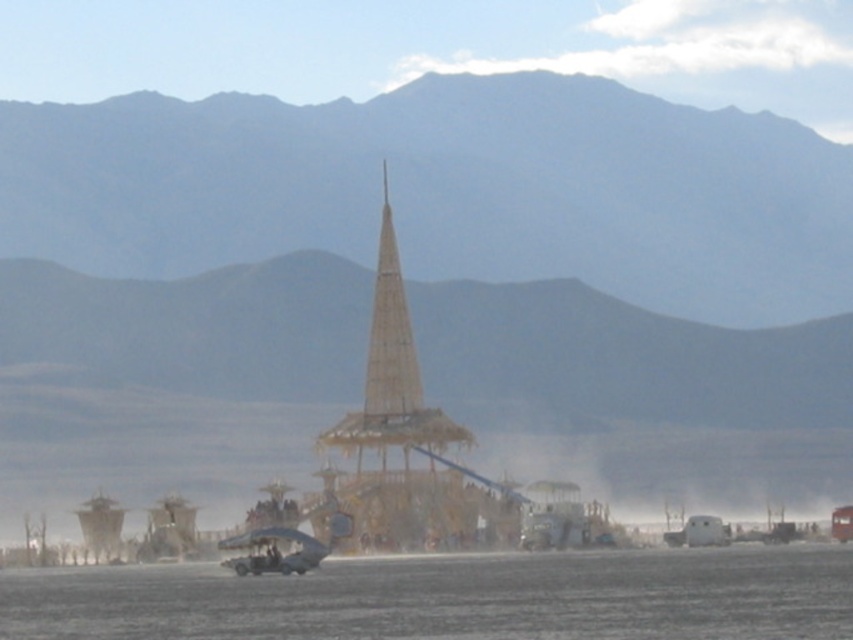
Which is below, desert sand mountain at center or clear ice at lower center?

clear ice at lower center is lower down.

The height and width of the screenshot is (640, 853). What are the coordinates of `desert sand mountain at center` in the screenshot? It's located at (447, 189).

This screenshot has width=853, height=640. Identify the location of desert sand mountain at center. (447, 189).

Does wooden tower at center have a smaller size compared to metallic silver fighter jet at center?

Incorrect, wooden tower at center is not smaller in size than metallic silver fighter jet at center.

Looking at this image, who is taller, wooden tower at center or metallic silver fighter jet at center?

Standing taller between the two is wooden tower at center.

Is point (367, 429) positioned in front of point (347, 515)?

Yes, it is in front of point (347, 515).

Image resolution: width=853 pixels, height=640 pixels. What are the coordinates of `wooden tower at center` in the screenshot? It's located at (397, 428).

Does desert sand mountain at center have a greater height compared to wooden tower at center?

No, desert sand mountain at center is not taller than wooden tower at center.

Can you confirm if desert sand mountain at center is positioned to the left of wooden tower at center?

Incorrect, desert sand mountain at center is not on the left side of wooden tower at center.

Who is more distant from viewer, (845, 196) or (384, 497)?

The point (845, 196) is more distant.

Locate an element on the screen. The height and width of the screenshot is (640, 853). desert sand mountain at center is located at coordinates [x=447, y=189].